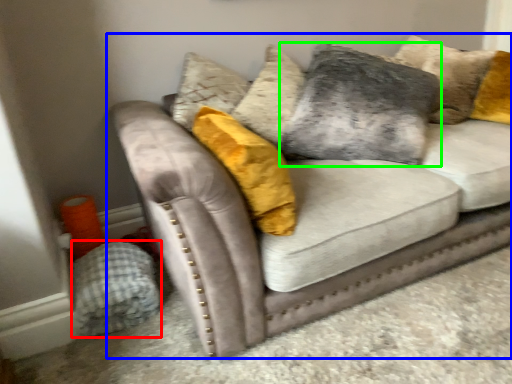
Question: Based on their relative distances, which object is farther from material (highlighted by a red box)? Choose from studio couch (highlighted by a blue box) and pillow (highlighted by a green box).

Choices:
 (A) studio couch
 (B) pillow

Answer: (B)